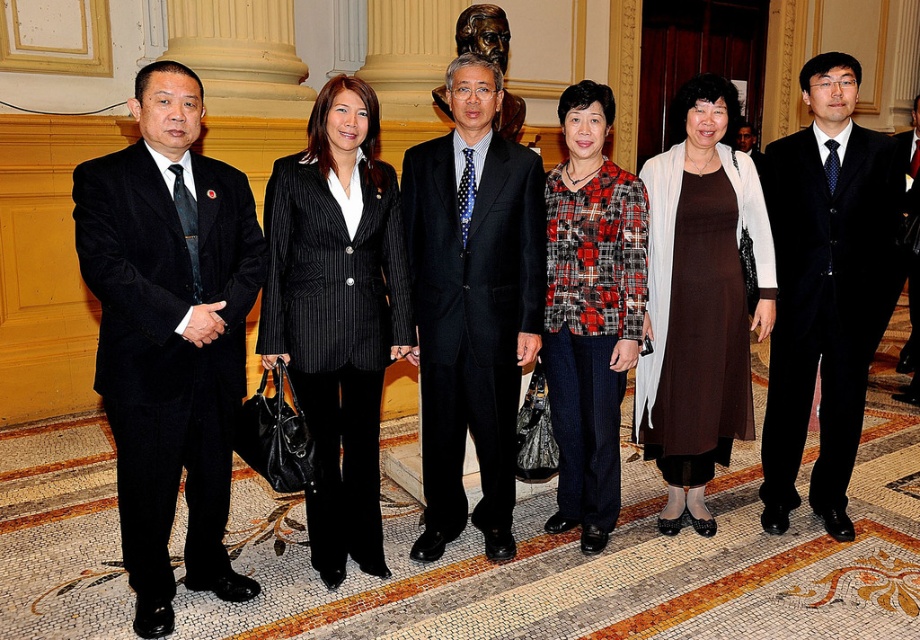
You are organizing a photo shoot and need to ensure that the two central figures in the image, the brown matte dress at center and the plaid fabric jacket at center, can fit side by side within a 1.5 meter wide frame. Based on their sizes, will they fit comfortably?

The brown matte dress at center is wider than the plaid fabric jacket at center. However, without specific measurements, it is impossible to determine if their combined width will fit within the 1.5 meter frame.

You are standing in the grand hall and need to locate the brown matte dress at center. According to the coordinates provided, where exactly is it positioned?

The brown matte dress at center is located at point coordinates of 0.472 on the x axis and 0.761 on the y axis.